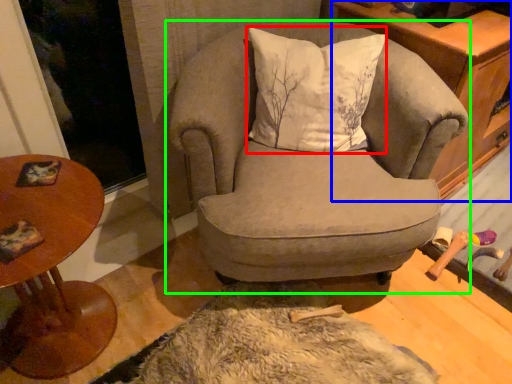
Question: Based on their relative distances, which object is nearer to pillow (highlighted by a red box)? Choose from cabinetry (highlighted by a blue box) and chair (highlighted by a green box).

Choices:
 (A) cabinetry
 (B) chair

Answer: (B)